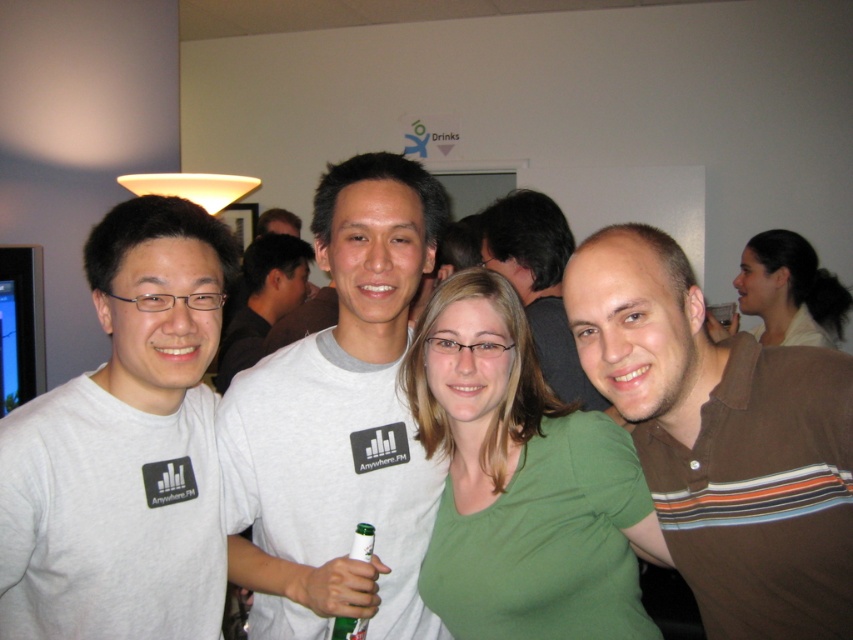
Question: Does green matte shirt at center appear over brown striped polo shirt at center?

Choices:
 (A) yes
 (B) no

Answer: (B)

Question: Which point appears farthest from the camera in this image?

Choices:
 (A) (114, 625)
 (B) (769, 333)
 (C) (332, 202)

Answer: (B)

Question: Is blonde hair at upper right thinner than white cotton shirt at center?

Choices:
 (A) no
 (B) yes

Answer: (A)

Question: Based on their relative distances, which object is nearer to the white cotton t-shirt at center?

Choices:
 (A) white matte t-shirt at left
 (B) brown striped polo shirt at right
 (C) brown striped polo shirt at center
 (D) green glass bottle at center

Answer: (A)

Question: Which object is positioned closest to the white matte t-shirt at left?

Choices:
 (A) white cotton t-shirt at center
 (B) brown striped polo shirt at center
 (C) white cotton shirt at center

Answer: (A)

Question: Is white matte t-shirt at left above white cotton t-shirt at center?

Choices:
 (A) no
 (B) yes

Answer: (B)